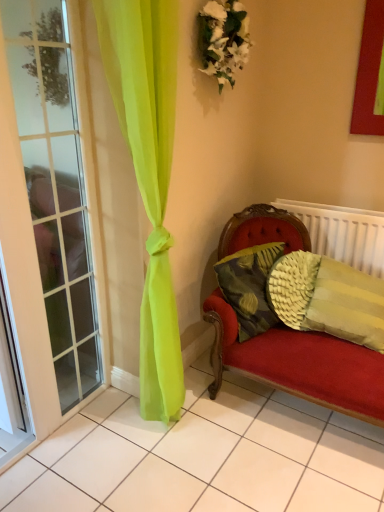
Question: Does textured yellow pillow at right, positioned as the first pillow in right-to-left order, have a lesser width compared to white fabric floral arrangement at upper center?

Choices:
 (A) no
 (B) yes

Answer: (A)

Question: Considering the relative sizes of textured yellow pillow at right, which ranks as the 2th pillow in left-to-right order, and white fabric floral arrangement at upper center in the image provided, is textured yellow pillow at right, which ranks as the 2th pillow in left-to-right order, shorter than white fabric floral arrangement at upper center?

Choices:
 (A) no
 (B) yes

Answer: (A)

Question: Does textured yellow pillow at right, which ranks as the 2th pillow in left-to-right order, contain white fabric floral arrangement at upper center?

Choices:
 (A) yes
 (B) no

Answer: (B)

Question: Is the depth of textured yellow pillow at right, which ranks as the 2th pillow in left-to-right order, less than that of white fabric floral arrangement at upper center?

Choices:
 (A) no
 (B) yes

Answer: (A)

Question: Is textured yellow pillow at right, which ranks as the 2th pillow in left-to-right order, taller than white fabric floral arrangement at upper center?

Choices:
 (A) yes
 (B) no

Answer: (A)

Question: From a real-world perspective, is textured yellow pillow at right, which ranks as the 2th pillow in left-to-right order, located beneath white fabric floral arrangement at upper center?

Choices:
 (A) no
 (B) yes

Answer: (B)

Question: From a real-world perspective, does white fabric floral arrangement at upper center sit lower than textured yellow pillow at right, which is the second pillow from right to left?

Choices:
 (A) yes
 (B) no

Answer: (B)

Question: Can you confirm if white fabric floral arrangement at upper center is bigger than textured yellow pillow at right, which is the second pillow from right to left?

Choices:
 (A) yes
 (B) no

Answer: (B)

Question: Is white fabric floral arrangement at upper center smaller than textured yellow pillow at right, which is the second pillow from right to left?

Choices:
 (A) yes
 (B) no

Answer: (A)

Question: Considering the relative positions of white fabric floral arrangement at upper center and textured yellow pillow at right, which is the second pillow from right to left, in the image provided, is white fabric floral arrangement at upper center in front of textured yellow pillow at right, which is the second pillow from right to left,?

Choices:
 (A) no
 (B) yes

Answer: (B)

Question: From the image's perspective, would you say white fabric floral arrangement at upper center is shown under textured yellow pillow at right, which is the second pillow from right to left?

Choices:
 (A) yes
 (B) no

Answer: (B)

Question: Is white fabric floral arrangement at upper center wider than textured yellow pillow at right, the first pillow from the left?

Choices:
 (A) yes
 (B) no

Answer: (B)

Question: Considering the relative positions of clear glass door at left and textured yellow pillow at right, positioned as the first pillow in right-to-left order, in the image provided, is clear glass door at left to the left of textured yellow pillow at right, positioned as the first pillow in right-to-left order, from the viewer's perspective?

Choices:
 (A) yes
 (B) no

Answer: (A)